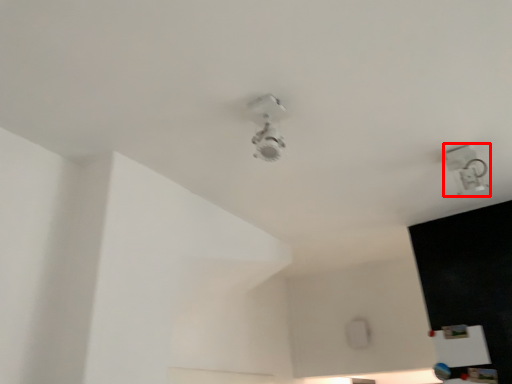
Question: Observing the image, what is the correct spatial positioning of lamp (annotated by the red box) in reference to lamp?

Choices:
 (A) left
 (B) right

Answer: (B)